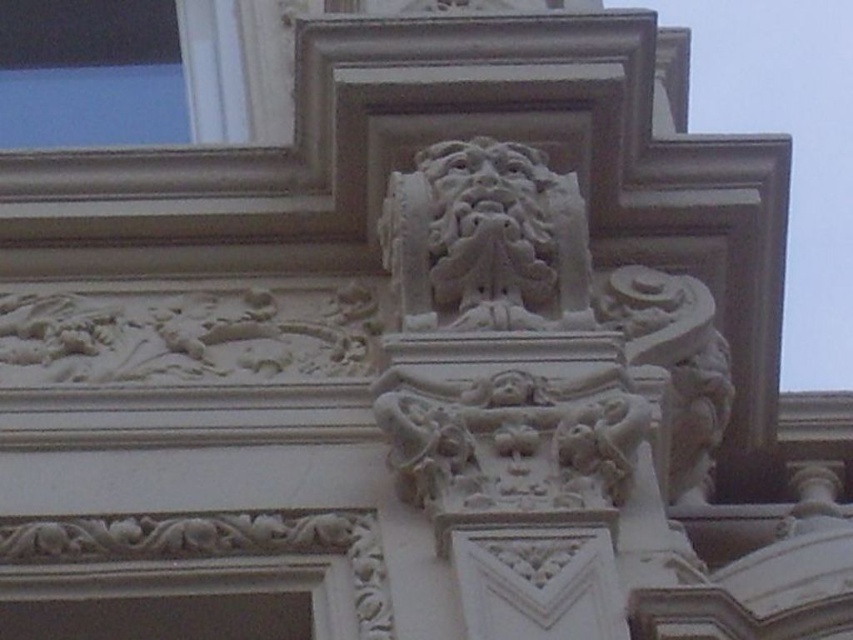
Does point (469, 220) come behind point (402, 234)?

No.

Locate an element on the screen. This screenshot has height=640, width=853. white stone sculpture at center is located at coordinates (532, 353).

Based on the photo, does white stone sculpture at upper center have a greater width compared to transparent glass window at upper left?

No, white stone sculpture at upper center is not wider than transparent glass window at upper left.

Is white stone sculpture at upper center behind transparent glass window at upper left?

No.

What do you see at coordinates (486, 240) in the screenshot? This screenshot has width=853, height=640. I see `white stone sculpture at upper center` at bounding box center [486, 240].

Where is `white stone sculpture at upper center`? The width and height of the screenshot is (853, 640). white stone sculpture at upper center is located at coordinates (486, 240).

Does point (654, 488) lie behind point (61, 131)?

No.

Can you confirm if white stone sculpture at center is taller than transparent glass window at upper left?

Yes.

Which is behind, point (409, 330) or point (202, 88)?

Point (202, 88)

In order to click on white stone sculpture at center in this screenshot , I will do `click(532, 353)`.